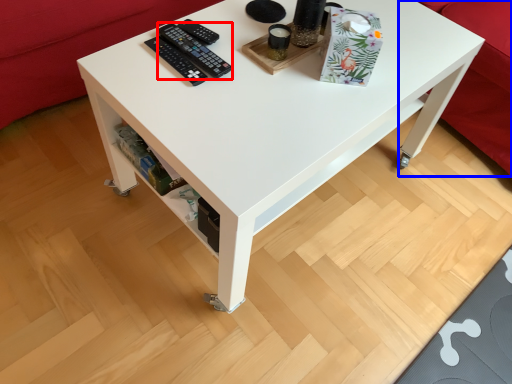
Question: Which object is closer to the camera taking this photo, control (highlighted by a red box) or couch (highlighted by a blue box)?

Choices:
 (A) control
 (B) couch

Answer: (A)